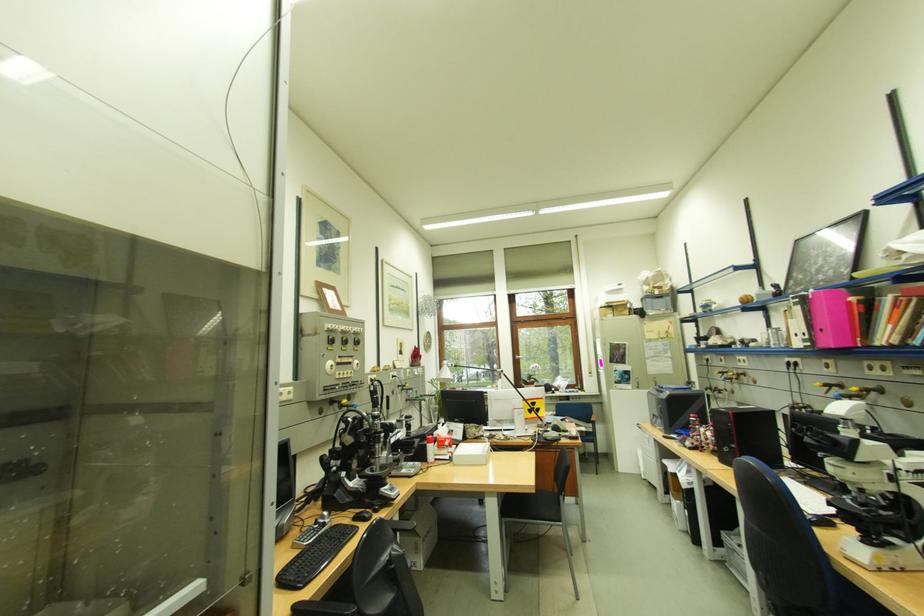
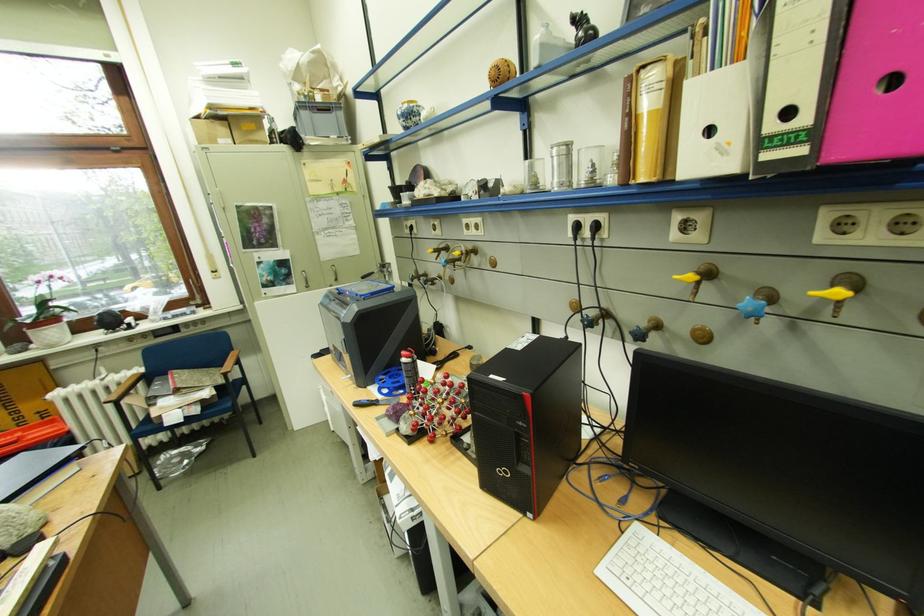
Where in the second image is the point corresponding to point (736, 375) from the first image?

(453, 253)